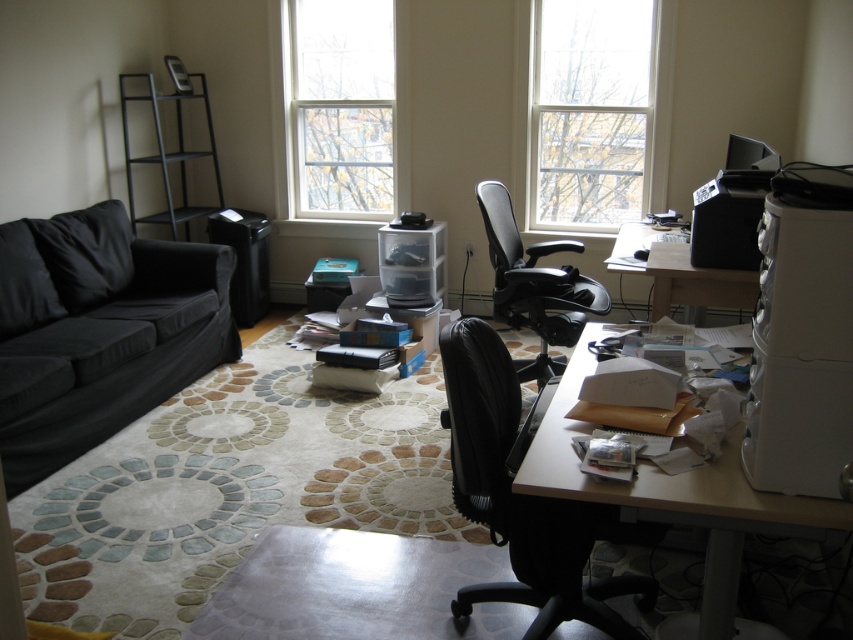
You are a delivery person who just arrived at the office. You need to place a package on the wooden desk at lower right. You are currently standing at the black mesh office chair at center. Is the distance between you and the desk sufficient to allow you to comfortably walk to the desk without needing to move any furniture?

The wooden desk at lower right and the black mesh office chair at center are 1.32 meters apart from each other. Since 1.32 meters is a reasonable distance for walking, you can comfortably walk to the desk without needing to move any furniture.

You are organizing a small event in the room and need to place a 1.5 meter wide banner between the wooden desk at lower right and the black mesh office chair at center. Considering their widths, will the banner fit between them?

The wooden desk at lower right has a lesser width compared to black mesh office chair at center. The total width of both objects is the desk width plus the chair width. Since the desk is narrower, the combined width would be less than 1.5 meters only if both are narrow enough. However, without exact measurements, it is impossible to determine if the banner will fit. The question does not provide enough information to confirm the banner will fit between them.

You are planning to rearrange the furniture in the room. If you want to place a new rectangular rug that must fit under both the black fabric couch at left and the wooden desk at lower right, which piece of furniture requires the rug to be wider?

The rug needs to be wider to accommodate the black fabric couch at left since its width is larger than the wooden desk at lower right.